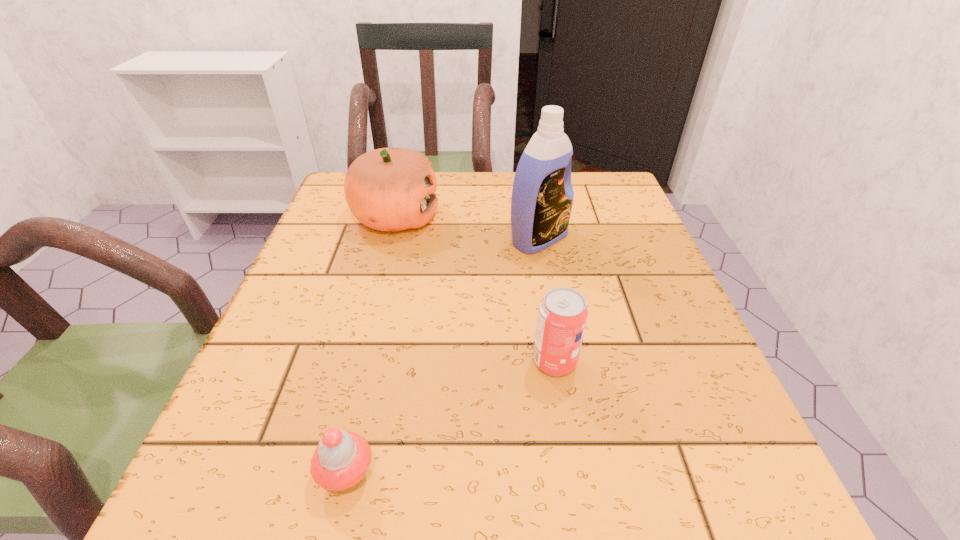
Where is `vacant region that satisfies the following two spatial constraints: 1. on the face of the second tallest object; 2. on the back side of the shortest object`? vacant region that satisfies the following two spatial constraints: 1. on the face of the second tallest object; 2. on the back side of the shortest object is located at coordinates (328, 474).

Find the location of a particular element. free space that satisfies the following two spatial constraints: 1. on the face of the pumpkin; 2. on the left side of the detergent is located at coordinates (390, 239).

Locate an element on the screen. The width and height of the screenshot is (960, 540). free spot that satisfies the following two spatial constraints: 1. on the face of the second nearest object; 2. on the left side of the pumpkin is located at coordinates (357, 362).